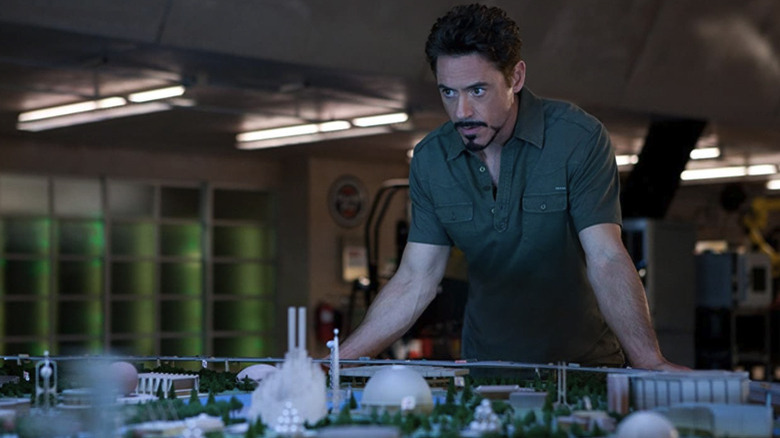
Where is `ceiling`? This screenshot has height=438, width=780. ceiling is located at coordinates (296, 33), (612, 51), (381, 32), (232, 24).